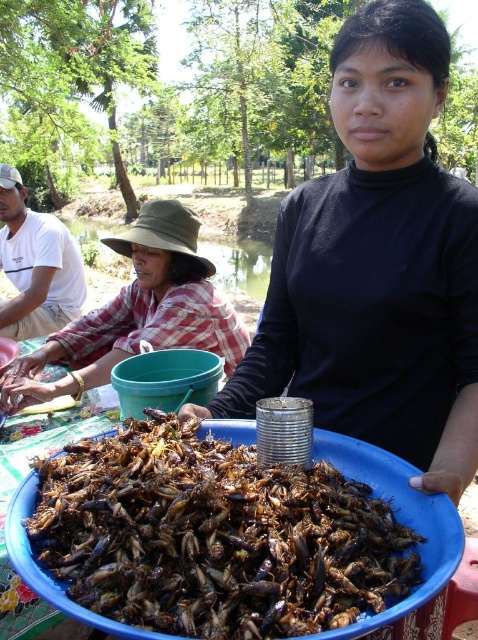
Question: Which object appears closest to the camera in this image?

Choices:
 (A) white cotton shirt at left
 (B) black matte bowl at center

Answer: (B)

Question: Observing the image, what is the correct spatial positioning of brown matte insects at center in reference to white cotton shirt at left?

Choices:
 (A) above
 (B) below

Answer: (B)

Question: Can you confirm if black matte bowl at center is positioned to the left of white cotton shirt at left?

Choices:
 (A) no
 (B) yes

Answer: (A)

Question: Observing the image, what is the correct spatial positioning of black matte bowl at center in reference to white cotton shirt at left?

Choices:
 (A) below
 (B) above

Answer: (A)

Question: Which object is positioned farthest from the brown matte insects at center?

Choices:
 (A) plaid fabric shirt at left
 (B) white cotton shirt at left

Answer: (B)

Question: Which object is the closest to the brown matte insects at center?

Choices:
 (A) black matte bowl at center
 (B) plaid fabric shirt at left
 (C) white cotton shirt at left

Answer: (A)